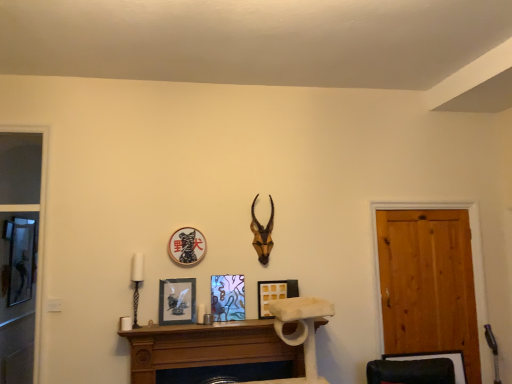
Question: From the image's perspective, is brown wooden antler at upper center on top of brown wooden fireplace at center?

Choices:
 (A) no
 (B) yes

Answer: (B)

Question: Is brown wooden antler at upper center to the right of brown wooden fireplace at center from the viewer's perspective?

Choices:
 (A) no
 (B) yes

Answer: (B)

Question: Does brown wooden antler at upper center have a greater height compared to brown wooden fireplace at center?

Choices:
 (A) yes
 (B) no

Answer: (A)

Question: Is brown wooden antler at upper center behind brown wooden fireplace at center?

Choices:
 (A) yes
 (B) no

Answer: (A)

Question: Does brown wooden antler at upper center have a smaller size compared to brown wooden fireplace at center?

Choices:
 (A) no
 (B) yes

Answer: (B)

Question: Can you confirm if brown wooden antler at upper center is wider than brown wooden fireplace at center?

Choices:
 (A) yes
 (B) no

Answer: (B)

Question: Is white ceramic candle holder at left shorter than wooden mantel at center?

Choices:
 (A) no
 (B) yes

Answer: (A)

Question: Is white ceramic candle holder at left touching wooden mantel at center?

Choices:
 (A) yes
 (B) no

Answer: (B)

Question: Is wooden mantel at center surrounded by white ceramic candle holder at left?

Choices:
 (A) no
 (B) yes

Answer: (A)

Question: From a real-world perspective, is white ceramic candle holder at left beneath wooden mantel at center?

Choices:
 (A) no
 (B) yes

Answer: (A)

Question: Considering the relative sizes of white ceramic candle holder at left and wooden mantel at center in the image provided, is white ceramic candle holder at left thinner than wooden mantel at center?

Choices:
 (A) yes
 (B) no

Answer: (A)

Question: From a real-world perspective, is white ceramic candle holder at left positioned over wooden mantel at center based on gravity?

Choices:
 (A) no
 (B) yes

Answer: (B)

Question: From a real-world perspective, is metallic glass picture frame at center, placed as the 3th picture frame when sorted from left to right, over black matte picture frame at center, the 3th picture frame when ordered from right to left?

Choices:
 (A) no
 (B) yes

Answer: (A)